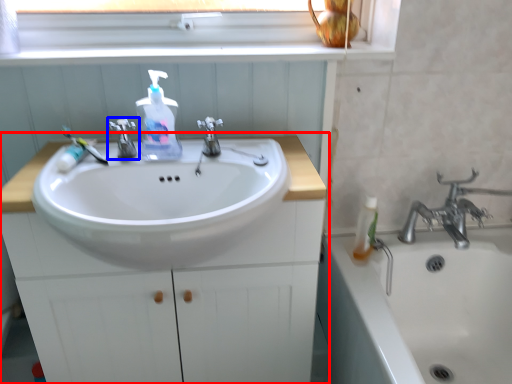
Question: Which object is further to the camera taking this photo, bathroom cabinet (highlighted by a red box) or tap (highlighted by a blue box)?

Choices:
 (A) bathroom cabinet
 (B) tap

Answer: (B)